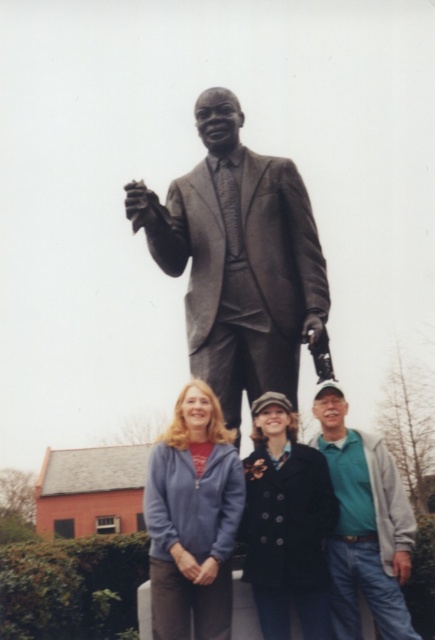
Question: Does bronze statue at center lie in front of dark blue wool coat at center?

Choices:
 (A) yes
 (B) no

Answer: (B)

Question: Can you confirm if light blue fleece jacket at center is positioned to the left of teal-green shirt at lower right?

Choices:
 (A) no
 (B) yes

Answer: (B)

Question: Can you confirm if bronze statue at center is bigger than dark blue wool coat at center?

Choices:
 (A) yes
 (B) no

Answer: (A)

Question: Considering the real-world distances, which object is farthest from the teal-green shirt at lower right?

Choices:
 (A) dark blue wool coat at center
 (B) light blue fleece jacket at center

Answer: (B)

Question: Estimate the real-world distances between objects in this image. Which object is closer to the dark blue wool coat at center?

Choices:
 (A) light blue fleece jacket at center
 (B) bronze statue at center

Answer: (A)

Question: Which of the following is the farthest from the observer?

Choices:
 (A) (361, 522)
 (B) (310, 576)
 (C) (218, 476)
 (D) (247, 320)

Answer: (A)